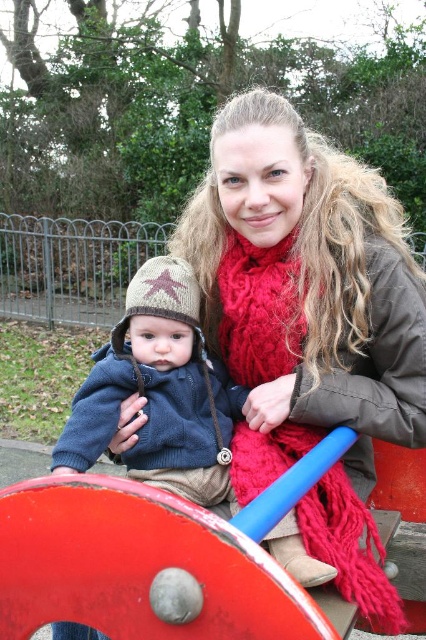
What do you see at coordinates (157, 390) in the screenshot?
I see `knitted brown hat at center` at bounding box center [157, 390].

Is point (215, 406) positioned before point (252, 486)?

No, it is behind (252, 486).

Is point (178, 305) closer to viewer compared to point (268, 483)?

No, it is behind (268, 483).

At what (x,y) coordinates should I click in order to perform the action: click on knitted brown hat at center. Please return your answer as a coordinate pair (x, y). The width and height of the screenshot is (426, 640). Looking at the image, I should click on (157, 390).